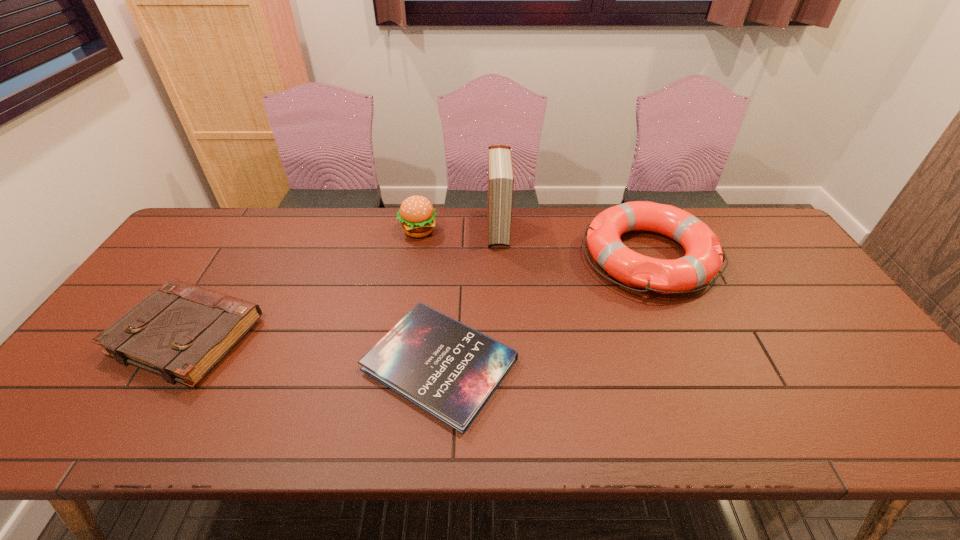
This screenshot has width=960, height=540. Find the location of `vacant space located on the front of the rightmost object`. vacant space located on the front of the rightmost object is located at coordinates (729, 442).

Image resolution: width=960 pixels, height=540 pixels. I want to click on free region located on the right of the second shortest hardback book, so click(x=380, y=336).

At what (x,y) coordinates should I click in order to perform the action: click on free space located on the back of the shortest object. Please return your answer as a coordinate pair (x, y). Image resolution: width=960 pixels, height=540 pixels. Looking at the image, I should click on (446, 275).

What are the coordinates of `hardback book positioned at the far edge` in the screenshot? It's located at (500, 168).

What are the coordinates of `hamburger at the far edge` in the screenshot? It's located at (417, 215).

Identify the location of life buoy that is at the far edge. (704, 257).

Find the location of a particular element. The width and height of the screenshot is (960, 540). object positioned at the near edge is located at coordinates (450, 370).

Identify the location of object that is at the left edge. This screenshot has width=960, height=540. (181, 331).

At what (x,y) coordinates should I click in order to perform the action: click on vacant space at the far edge of the desktop. Please return your answer as a coordinate pair (x, y). Looking at the image, I should click on (307, 244).

You are a GUI agent. You are given a task and a screenshot of the screen. Output one action in this format:
    pyautogui.click(x=<x>, y=<y>)
    Task: Click on the free region at the near edge of the desktop
    Image resolution: width=960 pixels, height=540 pixels.
    Given the screenshot: What is the action you would take?
    pyautogui.click(x=800, y=415)